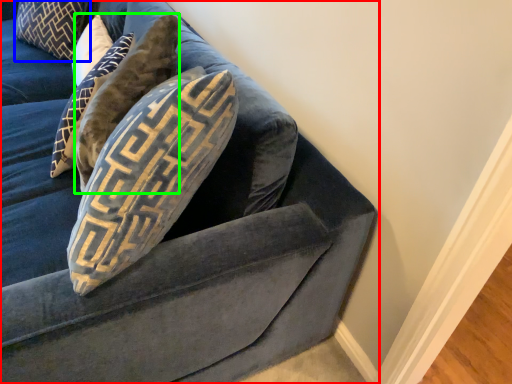
Question: Based on their relative distances, which object is farther from studio couch (highlighted by a red box)? Choose from pillow (highlighted by a blue box) and pillow (highlighted by a green box).

Choices:
 (A) pillow
 (B) pillow

Answer: (A)